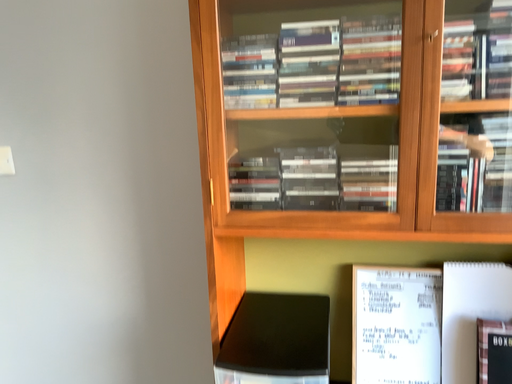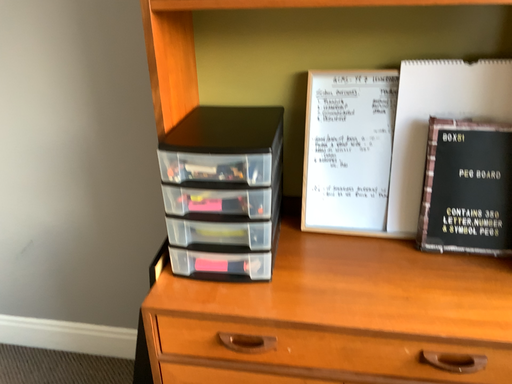
Question: How did the camera likely rotate when shooting the video?

Choices:
 (A) rotated downward
 (B) rotated upward

Answer: (A)